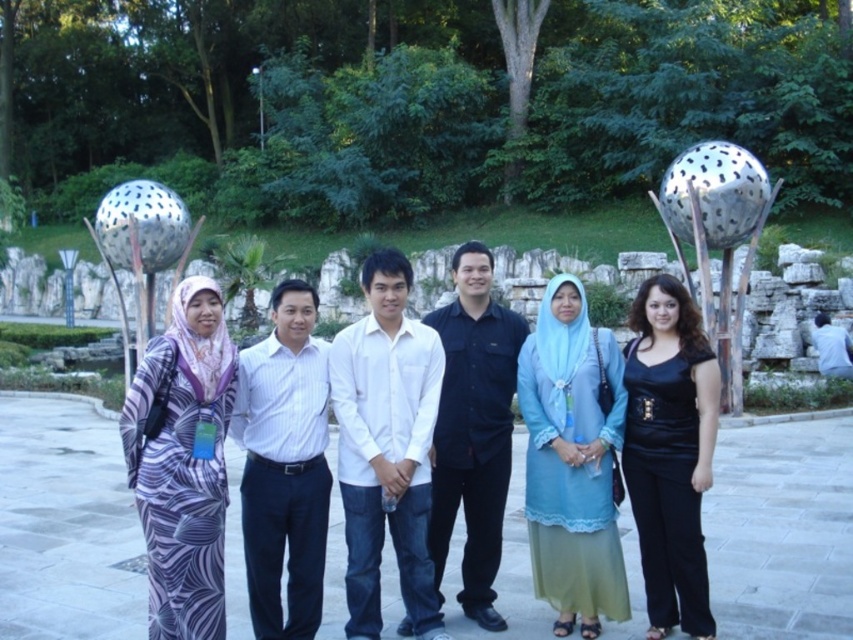
Is white cotton shirt at center behind light blue sheer dress at center?

No.

Is point (345, 452) closer to camera compared to point (595, 486)?

That is False.

Who is more distant from viewer, (370, 592) or (572, 365)?

The point (572, 365) is more distant.

Find the location of a particular element. Image resolution: width=853 pixels, height=640 pixels. white cotton shirt at center is located at coordinates (386, 445).

Who is lower down, white striped shirt at center or white cotton shirt at right?

Positioned lower is white striped shirt at center.

Which of these two, white striped shirt at center or white cotton shirt at right, stands taller?

white striped shirt at center is taller.

At what (x,y) coordinates should I click in order to perform the action: click on white striped shirt at center. Please return your answer as a coordinate pair (x, y). This screenshot has width=853, height=640. Looking at the image, I should click on (283, 465).

The width and height of the screenshot is (853, 640). Find the location of `white striped shirt at center`. white striped shirt at center is located at coordinates (283, 465).

What do you see at coordinates (386, 445) in the screenshot? This screenshot has width=853, height=640. I see `white cotton shirt at center` at bounding box center [386, 445].

At what (x,y) coordinates should I click in order to perform the action: click on white cotton shirt at center. Please return your answer as a coordinate pair (x, y). The height and width of the screenshot is (640, 853). Looking at the image, I should click on (386, 445).

Is point (434, 342) farther from camera compared to point (494, 518)?

Yes.

You are a GUI agent. You are given a task and a screenshot of the screen. Output one action in this format:
    pyautogui.click(x=<x>, y=<y>)
    Task: Click on the white cotton shirt at center
    This screenshot has width=853, height=640.
    Given the screenshot: What is the action you would take?
    pyautogui.click(x=386, y=445)